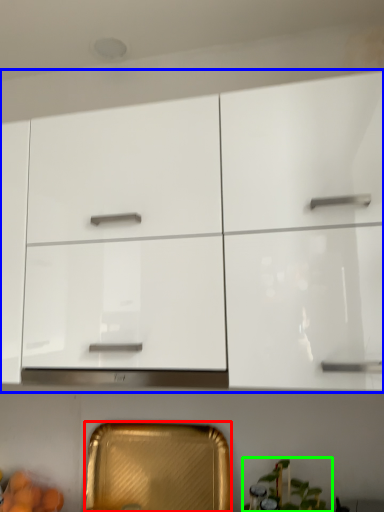
Question: Based on their relative distances, which object is farther from cabinetry (highlighted by a red box)? Choose from cabinetry (highlighted by a blue box) and plant (highlighted by a green box).

Choices:
 (A) cabinetry
 (B) plant

Answer: (A)